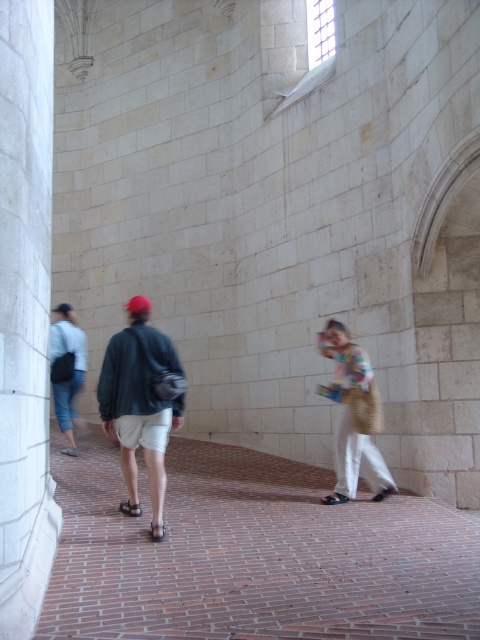
Question: Considering the relative positions of black leather sandal at lower center and brown leather sandal at lower left in the image provided, where is black leather sandal at lower center located with respect to brown leather sandal at lower left?

Choices:
 (A) left
 (B) right

Answer: (B)

Question: Considering the relative positions of black leather sandal at lower left and brown leather sandal at lower left in the image provided, where is black leather sandal at lower left located with respect to brown leather sandal at lower left?

Choices:
 (A) left
 (B) right

Answer: (B)

Question: Among these objects, which one is nearest to the camera?

Choices:
 (A) denim pants at left
 (B) black leather sandal at lower center

Answer: (B)

Question: Which point is closer to the camera?

Choices:
 (A) (396, 490)
 (B) (339, 460)
 (C) (135, 508)
 (D) (137, 360)

Answer: (D)

Question: Does multicolored woven bag at center come behind brown leather sandal at lower center?

Choices:
 (A) no
 (B) yes

Answer: (B)

Question: Estimate the real-world distances between objects in this image. Which object is closer to the matte black jacket at center?

Choices:
 (A) black leather sandal at lower center
 (B) brown leather sandal at lower left
 (C) brown leather sandal at lower center
 (D) denim pants at left

Answer: (A)